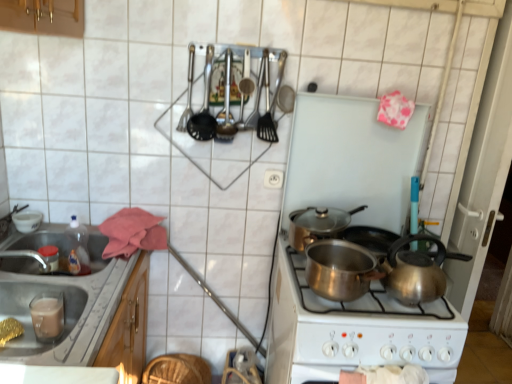
Question: Can we say shiny metallic kettle at center right lies outside metallic stainless steel sink at lower left?

Choices:
 (A) yes
 (B) no

Answer: (A)

Question: Does shiny metallic kettle at center right have a smaller size compared to metallic stainless steel sink at lower left?

Choices:
 (A) no
 (B) yes

Answer: (B)

Question: Considering the relative positions of shiny metallic kettle at center right and metallic stainless steel sink at lower left in the image provided, is shiny metallic kettle at center right to the right of metallic stainless steel sink at lower left from the viewer's perspective?

Choices:
 (A) no
 (B) yes

Answer: (B)

Question: Is shiny metallic kettle at center right at the left side of metallic stainless steel sink at lower left?

Choices:
 (A) yes
 (B) no

Answer: (B)

Question: Can you confirm if shiny metallic kettle at center right is taller than metallic stainless steel sink at lower left?

Choices:
 (A) no
 (B) yes

Answer: (A)

Question: Is shiny metallic kettle at center right oriented away from metallic stainless steel sink at lower left?

Choices:
 (A) yes
 (B) no

Answer: (B)

Question: Considering the relative sizes of shiny silver pot at center, the first kitchen appliance when ordered from top to bottom, and shiny metallic kettle at center right in the image provided, is shiny silver pot at center, the first kitchen appliance when ordered from top to bottom, thinner than shiny metallic kettle at center right?

Choices:
 (A) no
 (B) yes

Answer: (A)

Question: From a real-world perspective, does shiny silver pot at center, the 2th kitchen appliance when ordered from front to back, sit lower than shiny metallic kettle at center right?

Choices:
 (A) no
 (B) yes

Answer: (A)

Question: Considering the relative sizes of shiny silver pot at center, the second kitchen appliance when ordered from bottom to top, and shiny metallic kettle at center right in the image provided, is shiny silver pot at center, the second kitchen appliance when ordered from bottom to top, wider than shiny metallic kettle at center right?

Choices:
 (A) no
 (B) yes

Answer: (B)

Question: Is shiny silver pot at center, the first kitchen appliance viewed from the back, in contact with shiny metallic kettle at center right?

Choices:
 (A) yes
 (B) no

Answer: (B)

Question: Is shiny silver pot at center, the first kitchen appliance when ordered from top to bottom, behind shiny metallic kettle at center right?

Choices:
 (A) yes
 (B) no

Answer: (A)

Question: Considering the relative sizes of shiny silver pot at center, the 2th kitchen appliance when ordered from front to back, and shiny metallic kettle at center right in the image provided, is shiny silver pot at center, the 2th kitchen appliance when ordered from front to back, shorter than shiny metallic kettle at center right?

Choices:
 (A) yes
 (B) no

Answer: (A)

Question: Does shiny silver pot at center, the 2th kitchen appliance when ordered from front to back, have a smaller size compared to white plastic electric outlet at center?

Choices:
 (A) yes
 (B) no

Answer: (B)